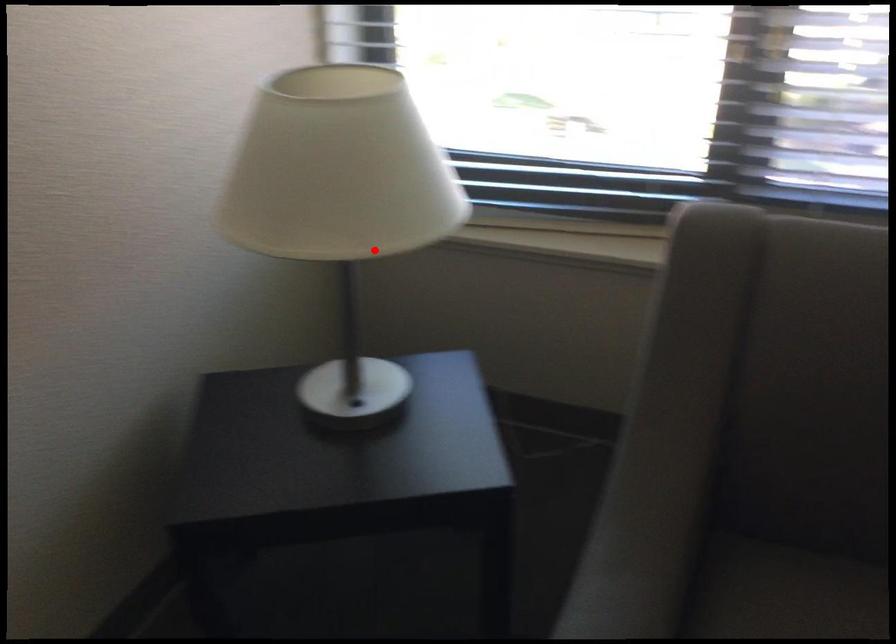
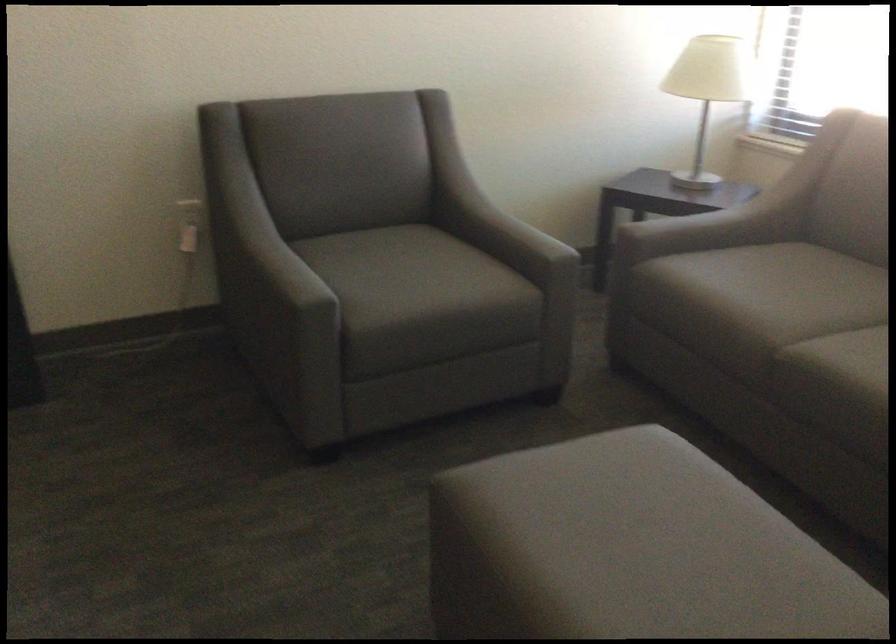
Question: I am providing you with two images of the same scene from different viewpoints. A red point is shown in image1. For the corresponding object point in image2, is it positioned nearer or farther from the camera?

Choices:
 (A) Nearer
 (B) Farther

Answer: (B)